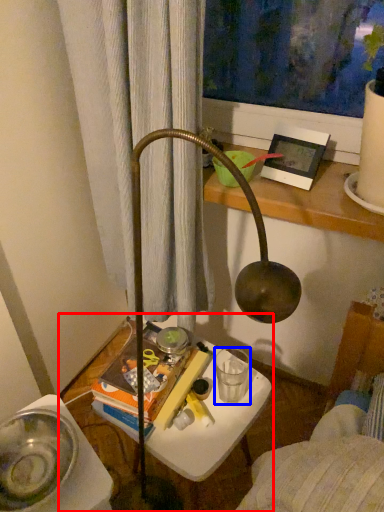
Question: Which of the following is the closest to the observer, table (highlighted by a red box) or beverage (highlighted by a blue box)?

Choices:
 (A) table
 (B) beverage

Answer: (A)